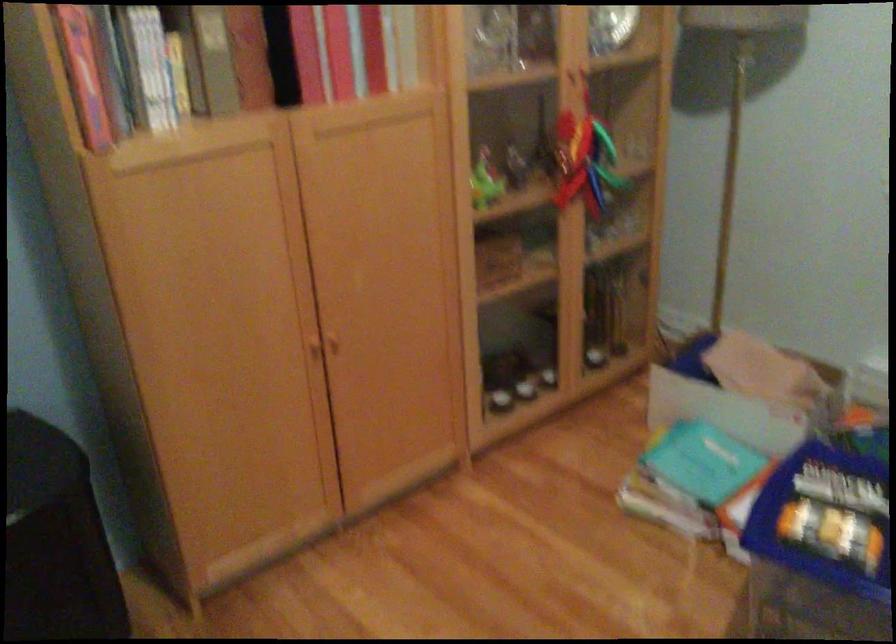
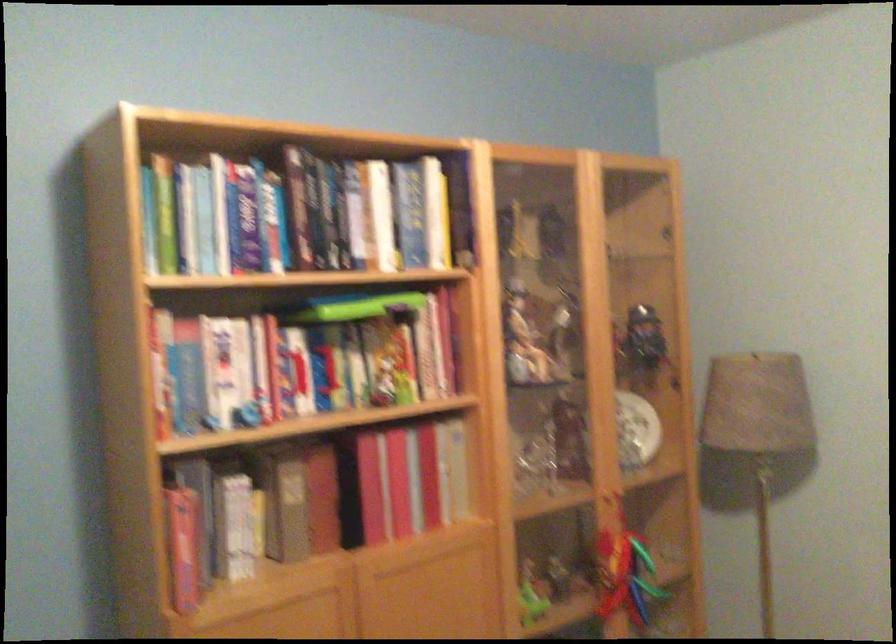
Question: In a continuous first-person perspective shot, in which direction is the camera moving?

Choices:
 (A) Left
 (B) Right
 (C) Forward
 (D) Backward

Answer: (D)